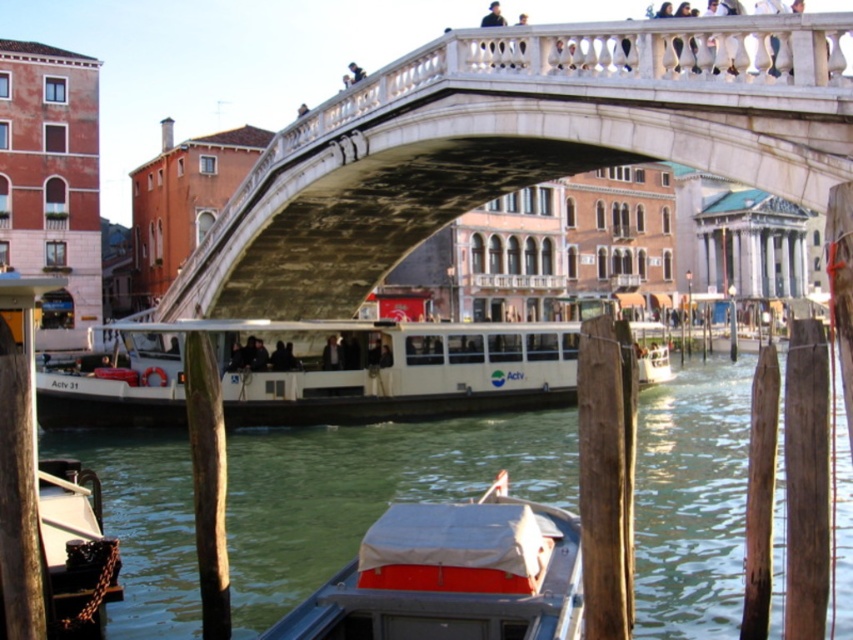
Question: Is white marble bridge at center behind white canvas boat at lower center?

Choices:
 (A) no
 (B) yes

Answer: (B)

Question: Which of these objects is positioned farthest from the white marble bridge at center?

Choices:
 (A) white matte boat at center
 (B) white canvas boat at lower center

Answer: (B)

Question: Does white matte boat at center appear on the left side of white canvas boat at lower center?

Choices:
 (A) no
 (B) yes

Answer: (A)

Question: Which of the following is the farthest from the observer?

Choices:
 (A) (241, 390)
 (B) (468, 576)

Answer: (A)

Question: Which of the following is the farthest from the observer?

Choices:
 (A) (502, 588)
 (B) (701, 42)

Answer: (B)

Question: In this image, where is white matte boat at center located relative to white canvas boat at lower center?

Choices:
 (A) below
 (B) above

Answer: (B)